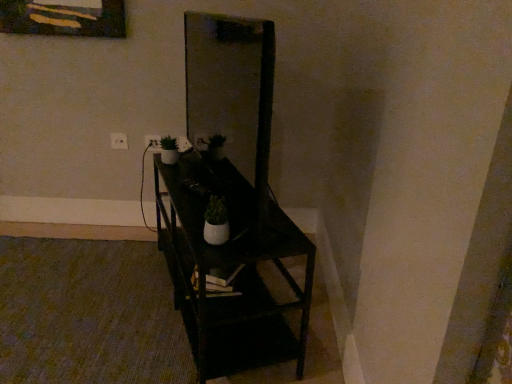
Question: From the image's perspective, is white plastic electric outlet at upper center, which appears as the 1th electric outlet when viewed from the right, located beneath black matte shelf at center?

Choices:
 (A) no
 (B) yes

Answer: (A)

Question: Does white plastic electric outlet at upper center, which appears as the 1th electric outlet when viewed from the right, lie in front of black matte shelf at center?

Choices:
 (A) yes
 (B) no

Answer: (B)

Question: Is white plastic electric outlet at upper center, the second electric outlet viewed from the left, positioned with its back to black matte shelf at center?

Choices:
 (A) yes
 (B) no

Answer: (B)

Question: Considering the relative sizes of white plastic electric outlet at upper center, the second electric outlet viewed from the left, and black matte shelf at center in the image provided, is white plastic electric outlet at upper center, the second electric outlet viewed from the left, bigger than black matte shelf at center?

Choices:
 (A) no
 (B) yes

Answer: (A)

Question: Does white plastic electric outlet at upper center, which appears as the 1th electric outlet when viewed from the right, have a lesser width compared to black matte shelf at center?

Choices:
 (A) yes
 (B) no

Answer: (A)

Question: Considering the positions of white plastic electric outlet at upper left, the 1th electric outlet when ordered from left to right, and matte glass mirror at center in the image, is white plastic electric outlet at upper left, the 1th electric outlet when ordered from left to right, wider or thinner than matte glass mirror at center?

Choices:
 (A) thin
 (B) wide

Answer: (A)

Question: Considering the relative positions of white plastic electric outlet at upper left, the 1th electric outlet when ordered from left to right, and matte glass mirror at center in the image provided, is white plastic electric outlet at upper left, the 1th electric outlet when ordered from left to right, to the left or to the right of matte glass mirror at center?

Choices:
 (A) right
 (B) left

Answer: (B)

Question: From a real-world perspective, is white plastic electric outlet at upper left, the 2th electric outlet positioned from the right, positioned above or below matte glass mirror at center?

Choices:
 (A) below
 (B) above

Answer: (A)

Question: In terms of size, does white plastic electric outlet at upper left, the 1th electric outlet when ordered from left to right, appear bigger or smaller than matte glass mirror at center?

Choices:
 (A) big
 (B) small

Answer: (B)

Question: Choose the correct answer: Is matte glass mirror at center inside white plastic electric outlet at upper center, the second electric outlet viewed from the left, or outside it?

Choices:
 (A) inside
 (B) outside

Answer: (B)

Question: Considering the relative positions of matte glass mirror at center and white plastic electric outlet at upper center, the second electric outlet viewed from the left, in the image provided, is matte glass mirror at center to the left or to the right of white plastic electric outlet at upper center, the second electric outlet viewed from the left,?

Choices:
 (A) left
 (B) right

Answer: (B)

Question: From a real-world perspective, is matte glass mirror at center above or below white plastic electric outlet at upper center, which appears as the 1th electric outlet when viewed from the right?

Choices:
 (A) above
 (B) below

Answer: (A)

Question: In terms of width, does matte glass mirror at center look wider or thinner when compared to white plastic electric outlet at upper center, which appears as the 1th electric outlet when viewed from the right?

Choices:
 (A) wide
 (B) thin

Answer: (A)

Question: Looking at the image, does matte glass mirror at center seem bigger or smaller compared to black matte shelf at center?

Choices:
 (A) small
 (B) big

Answer: (A)

Question: From the image's perspective, is matte glass mirror at center above or below black matte shelf at center?

Choices:
 (A) above
 (B) below

Answer: (A)